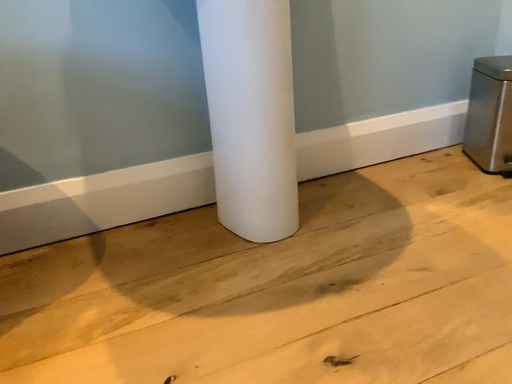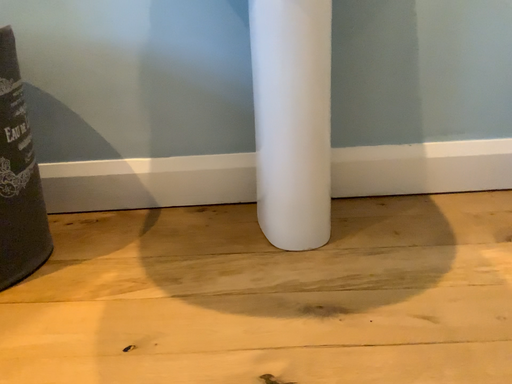
Question: How did the camera likely rotate when shooting the video?

Choices:
 (A) rotated left
 (B) rotated right

Answer: (A)